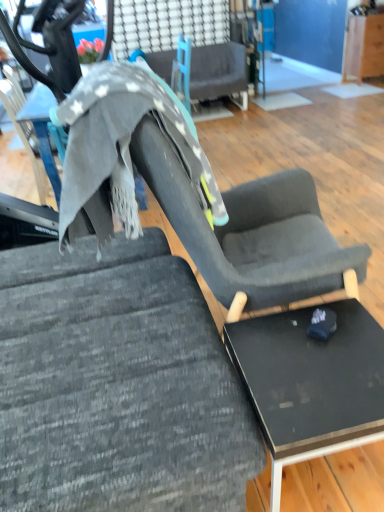
Question: From the image's perspective, is textured gray fabric chair at center, which is counted as the 1th chair, starting from the back, located above or below black glossy table at lower right?

Choices:
 (A) below
 (B) above

Answer: (B)

Question: Do you think textured gray fabric chair at center, which is counted as the 1th chair, starting from the back, is within black glossy table at lower right, or outside of it?

Choices:
 (A) inside
 (B) outside

Answer: (B)

Question: Estimate the real-world distances between objects in this image. Which object is farther from the black glossy table at lower right?

Choices:
 (A) textured gray fabric at center, the first chair viewed from the front
 (B) textured gray fabric chair at center, marked as the first chair in a top-to-bottom arrangement

Answer: (B)

Question: Estimate the real-world distances between objects in this image. Which object is farther from the textured gray fabric at center, the second chair in the top-to-bottom sequence?

Choices:
 (A) textured gray fabric chair at center, marked as the first chair in a top-to-bottom arrangement
 (B) black glossy table at lower right

Answer: (A)